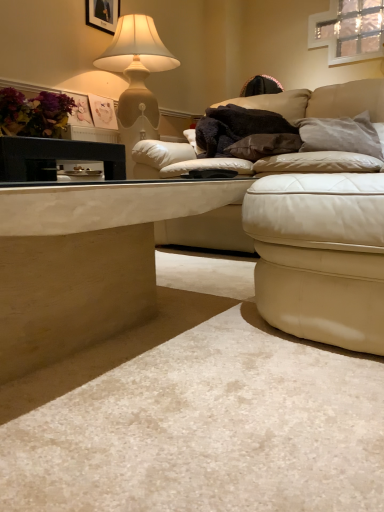
Where is `vacant area that lies between leather ottoman at lower right and smooth beige table at lower left, the 2th table positioned from the top`? This screenshot has width=384, height=512. vacant area that lies between leather ottoman at lower right and smooth beige table at lower left, the 2th table positioned from the top is located at coordinates (217, 362).